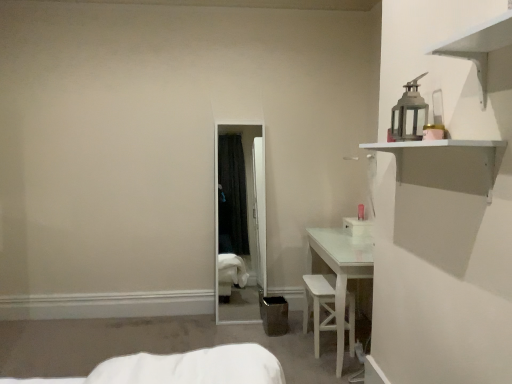
Question: From a real-world perspective, is white matte shelf at upper right physically located above or below white wood chair at lower center?

Choices:
 (A) below
 (B) above

Answer: (B)

Question: Is point (479, 150) positioned closer to the camera than point (307, 286)?

Choices:
 (A) farther
 (B) closer

Answer: (B)

Question: Would you say white matte shelf at upper right is to the left or to the right of white wood chair at lower center in the picture?

Choices:
 (A) left
 (B) right

Answer: (B)

Question: From a real-world perspective, is white wood chair at lower center positioned above or below white matte shelf at upper right?

Choices:
 (A) above
 (B) below

Answer: (B)

Question: In terms of width, does white wood chair at lower center look wider or thinner when compared to white matte shelf at upper right?

Choices:
 (A) wide
 (B) thin

Answer: (A)

Question: From the image's perspective, is white wood chair at lower center above or below white matte shelf at upper right?

Choices:
 (A) above
 (B) below

Answer: (B)

Question: Is white wood chair at lower center situated inside white matte shelf at upper right or outside?

Choices:
 (A) inside
 (B) outside

Answer: (B)